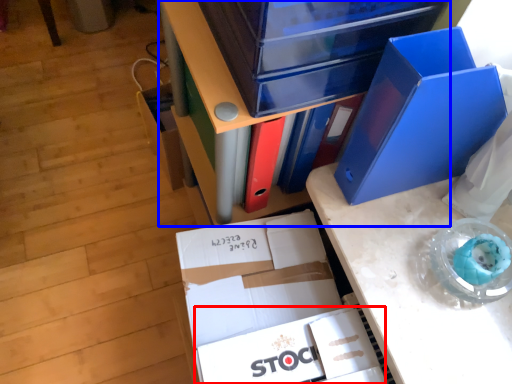
Question: Which object is closer to the camera taking this photo, paperback book (highlighted by a red box) or furniture (highlighted by a blue box)?

Choices:
 (A) paperback book
 (B) furniture

Answer: (B)